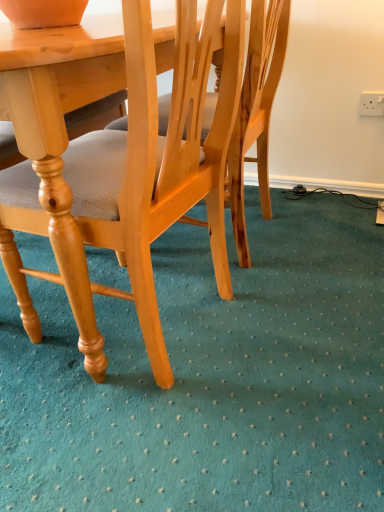
Question: Is light wood chair at center wider or thinner than white plastic power outlet at upper right?

Choices:
 (A) wide
 (B) thin

Answer: (A)

Question: Does point (155, 150) appear closer or farther from the camera than point (374, 94)?

Choices:
 (A) closer
 (B) farther

Answer: (A)

Question: Considering their positions, is light wood chair at center located in front of or behind white plastic power outlet at upper right?

Choices:
 (A) front
 (B) behind

Answer: (A)

Question: Is white plastic power outlet at upper right in front of or behind light wood chair at center in the image?

Choices:
 (A) behind
 (B) front

Answer: (A)

Question: Is white plastic power outlet at upper right taller or shorter than light wood chair at center?

Choices:
 (A) tall
 (B) short

Answer: (B)

Question: Looking at their shapes, would you say white plastic power outlet at upper right is wider or thinner than light wood chair at center?

Choices:
 (A) thin
 (B) wide

Answer: (A)

Question: Is white plastic power outlet at upper right bigger or smaller than light wood chair at center?

Choices:
 (A) small
 (B) big

Answer: (A)